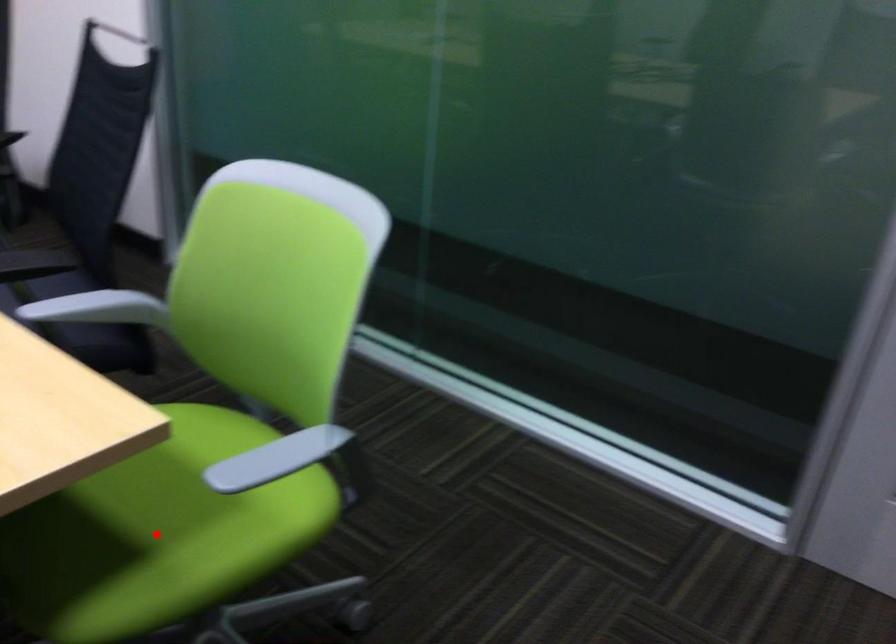
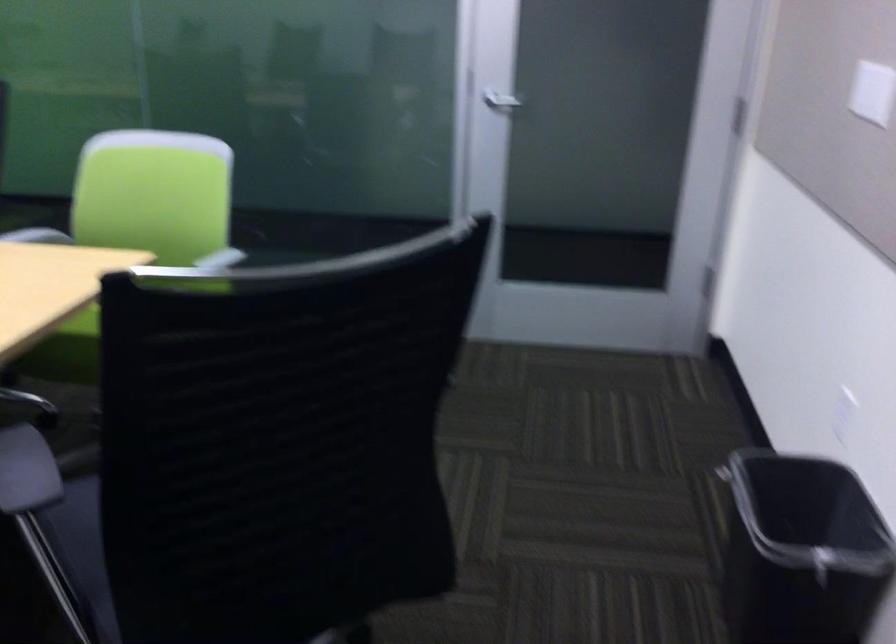
Question: I am providing you with two images of the same scene from different viewpoints. A red point is marked on the first image. At the location where the point appears in image 1, is it still visible in image 2?

Choices:
 (A) Yes
 (B) No

Answer: (B)